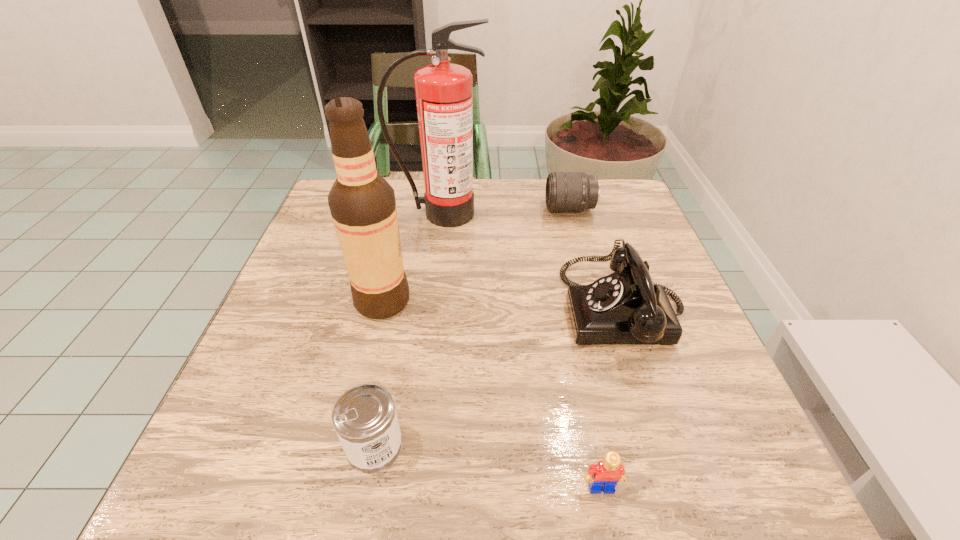
At what (x,y) coordinates should I click in order to perform the action: click on free space located 0.260m on the dial of the telephone. Please return your answer as a coordinate pair (x, y). The width and height of the screenshot is (960, 540). Looking at the image, I should click on (436, 310).

This screenshot has height=540, width=960. I want to click on free space located 0.380m on the surface of the telephoto lens, so click(x=400, y=209).

Where is `vacant space located on the surface of the telephoto lens`? This screenshot has width=960, height=540. vacant space located on the surface of the telephoto lens is located at coordinates (450, 209).

The image size is (960, 540). What are the coordinates of `vacant space positioned on the surface of the telephoto lens` in the screenshot? It's located at (504, 209).

The height and width of the screenshot is (540, 960). I want to click on vacant area situated on the right of the can, so click(x=626, y=446).

Locate an element on the screen. fire extinguisher present at the far edge is located at coordinates (443, 91).

Image resolution: width=960 pixels, height=540 pixels. Find the location of `telephoto lens situated at the far edge`. telephoto lens situated at the far edge is located at coordinates (565, 191).

The height and width of the screenshot is (540, 960). I want to click on can situated at the near edge, so click(364, 417).

Identify the location of Lego that is at the near edge. (606, 474).

Where is `object that is at the left edge`? object that is at the left edge is located at coordinates (362, 203).